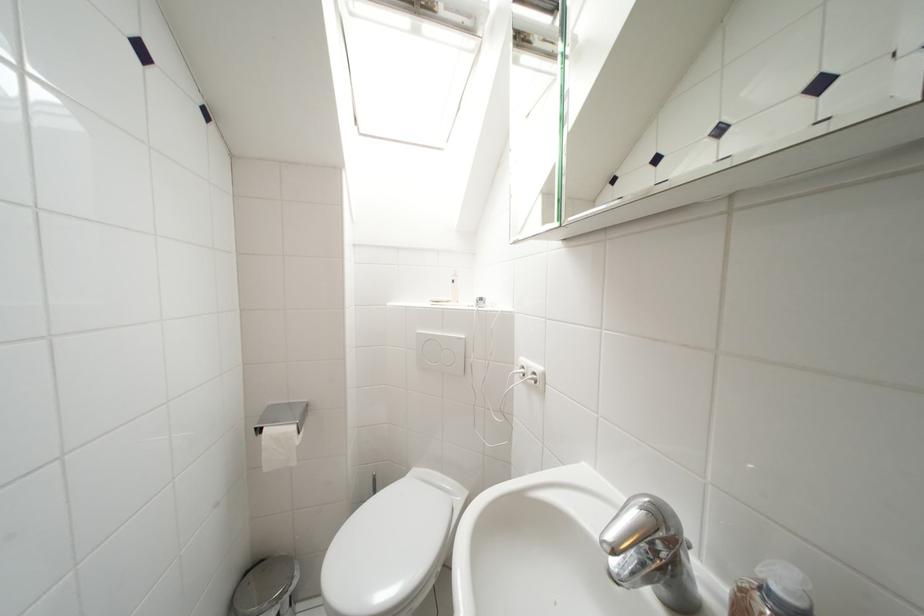
What do you see at coordinates (455, 286) in the screenshot? I see `the soap dispenser pump` at bounding box center [455, 286].